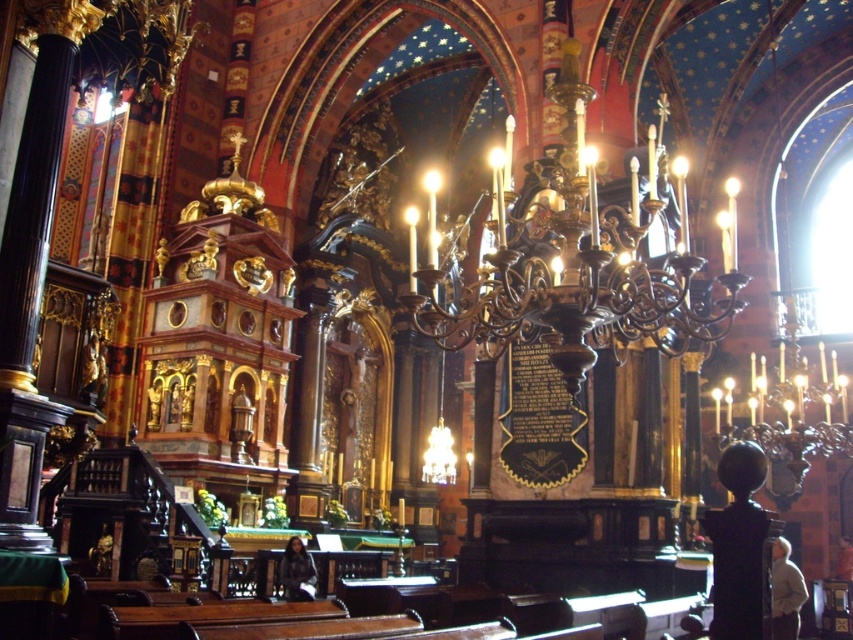
Question: Is light beige sweater at lower right above dark gray fabric jacket at lower center?

Choices:
 (A) yes
 (B) no

Answer: (A)

Question: Among these objects, which one is nearest to the camera?

Choices:
 (A) light beige sweater at lower right
 (B) dark gray fabric jacket at lower center

Answer: (A)

Question: Does light beige sweater at lower right have a larger size compared to dark gray fabric jacket at lower center?

Choices:
 (A) yes
 (B) no

Answer: (A)

Question: Does light beige sweater at lower right have a smaller size compared to dark gray fabric jacket at lower center?

Choices:
 (A) no
 (B) yes

Answer: (A)

Question: Which point is farther to the camera?

Choices:
 (A) (788, 602)
 (B) (283, 564)

Answer: (B)